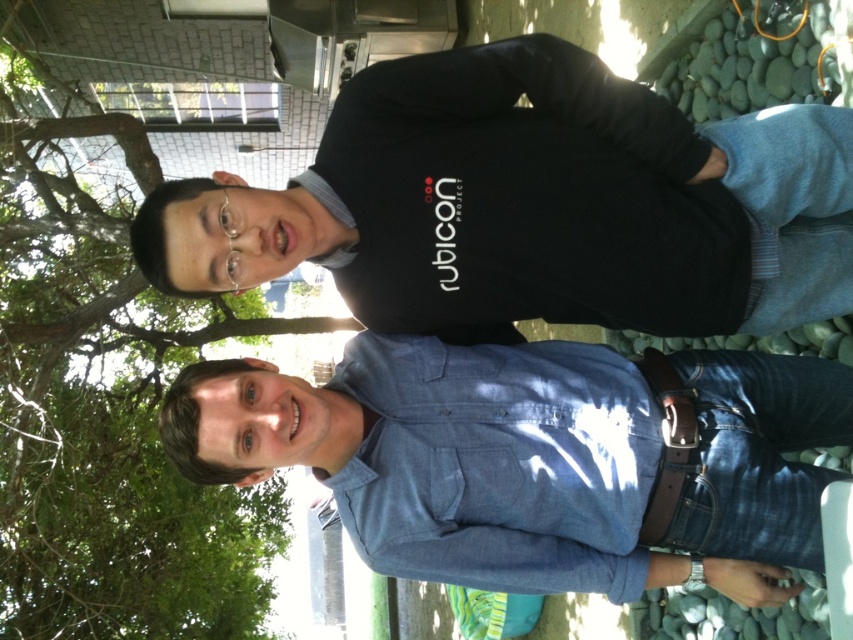
You are taking a photo of two people in an outdoor setting. The first person is at point (782, 417) and the second person is at point (202, 492). If you want to ensure both are in focus, which person should you focus on first?

You should focus on the person at point (782, 417) first because it is in front of the person at point (202, 492). This ensures the foreground subject is sharp before adjusting for the background.

You are a photographer standing at the position of the person in the foreground. You want to take a photo of the green leafy tree at upper left without the blue denim shirt at center blocking the view. Can you move sideways to the right to capture the tree in the frame?

The distance between the blue denim shirt at center and the green leafy tree at upper left is 4.81 meters. Moving sideways to the right may allow you to position yourself so that the blue denim shirt at center is no longer blocking the view of the green leafy tree at upper left, but the exact feasibility depends on the camera angle and available space.

You are a photographer trying to capture the blue denim shirt at center in your shot. Based on its 2D coordinates, where should you position your camera to ensure it is centered in the frame?

To center the blue denim shirt at center in your shot, position your camera so that the crosshairs align with the coordinates point (527, 456).